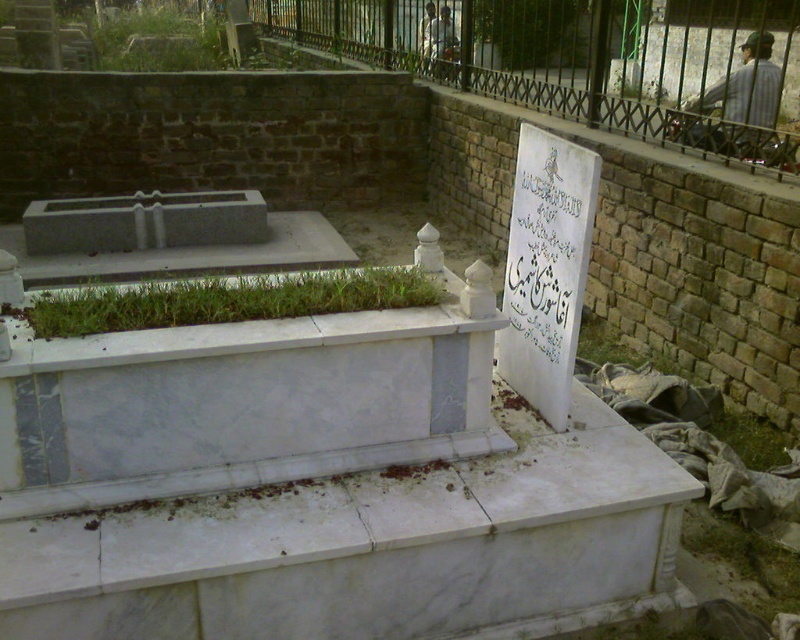
Consider the image. You are visiting the cemetery and want to take a photo of the black wrought iron fence at upper right and the striped shirt at upper right. Which object should you focus on first to ensure both are in clear view?

The black wrought iron fence at upper right is closer to the viewer than the striped shirt at upper right, so you should focus on the black wrought iron fence at upper right first to ensure both are in clear view.

You are standing at the point marked by coordinates point (778, 157) in the cemetery scene. You want to place a small bouquet of flowers on the tomb. Can you reach the tomb from your current position without moving closer than 3 meters to the tomb?

The distance between point (778, 157) and the viewer is 3.82 meters. Since you need to stay at least 3 meters away from the tomb, you can place the bouquet from your current position without moving closer.